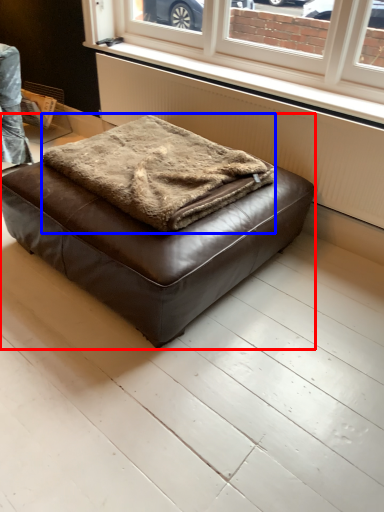
Question: Which of the following is the farthest to the observer, furniture (highlighted by a red box) or blanket (highlighted by a blue box)?

Choices:
 (A) furniture
 (B) blanket

Answer: (B)